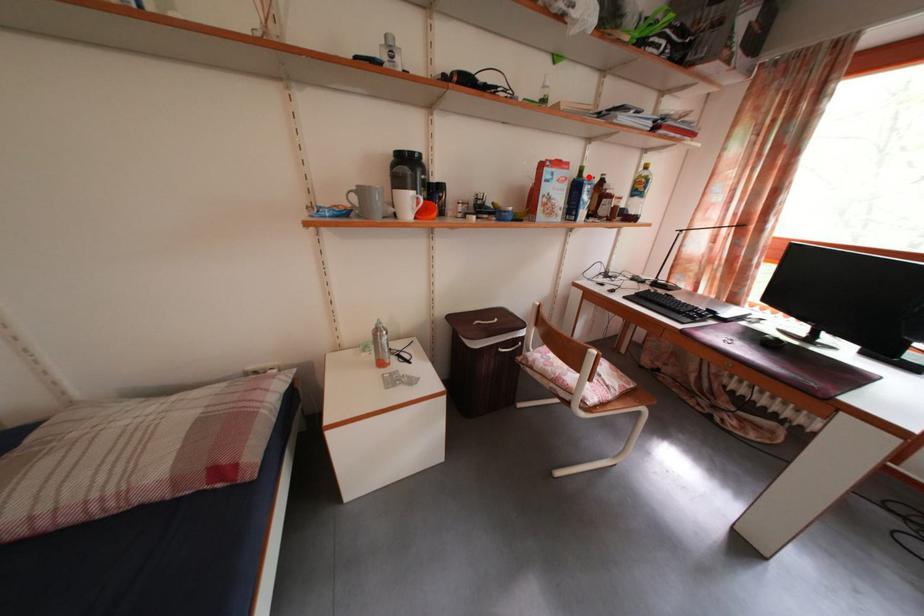
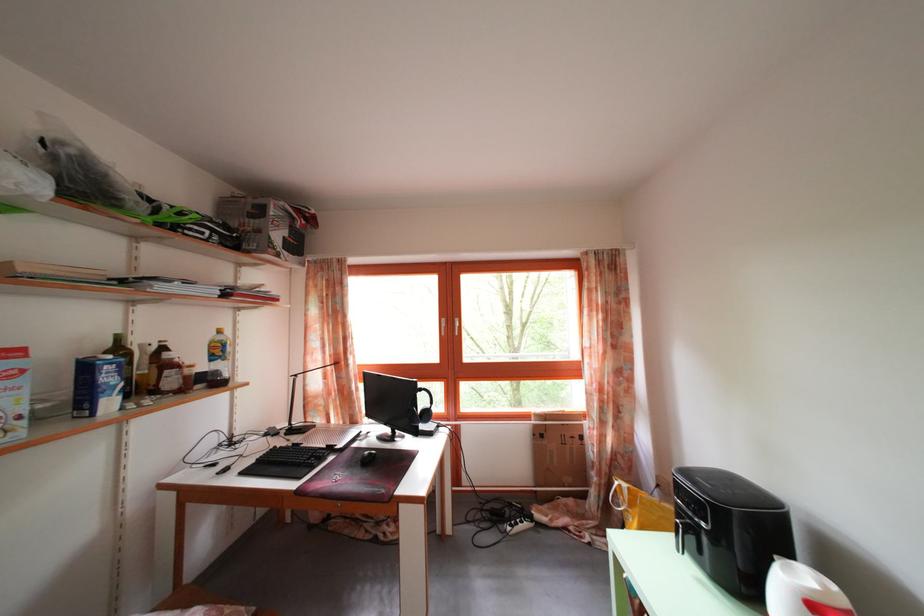
In the second image, find the point that corresponds to the highlighted location in the first image.

(126, 346)